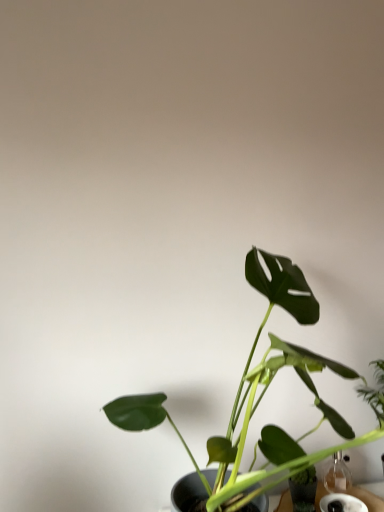
Question: From a real-world perspective, is transparent glass vase at lower right on green matte leafy plant at center?

Choices:
 (A) yes
 (B) no

Answer: (B)

Question: Is transparent glass vase at lower right taller than green matte leafy plant at center?

Choices:
 (A) no
 (B) yes

Answer: (A)

Question: Considering the relative sizes of transparent glass vase at lower right and green matte leafy plant at center in the image provided, is transparent glass vase at lower right bigger than green matte leafy plant at center?

Choices:
 (A) yes
 (B) no

Answer: (B)

Question: Is transparent glass vase at lower right far away from green matte leafy plant at center?

Choices:
 (A) yes
 (B) no

Answer: (B)

Question: From a real-world perspective, is transparent glass vase at lower right located beneath green matte leafy plant at center?

Choices:
 (A) no
 (B) yes

Answer: (B)

Question: Is transparent glass vase at lower right facing towards green matte leafy plant at center?

Choices:
 (A) no
 (B) yes

Answer: (B)

Question: Does green matte leafy plant at center have a greater width compared to transparent glass vase at lower right?

Choices:
 (A) yes
 (B) no

Answer: (A)

Question: Could you tell me if green matte leafy plant at center is facing transparent glass vase at lower right?

Choices:
 (A) yes
 (B) no

Answer: (B)

Question: Considering the relative sizes of green matte leafy plant at center and transparent glass vase at lower right in the image provided, is green matte leafy plant at center smaller than transparent glass vase at lower right?

Choices:
 (A) yes
 (B) no

Answer: (B)

Question: From a real-world perspective, does green matte leafy plant at center stand above transparent glass vase at lower right?

Choices:
 (A) yes
 (B) no

Answer: (A)

Question: From the image's perspective, is green matte leafy plant at center above transparent glass vase at lower right?

Choices:
 (A) no
 (B) yes

Answer: (B)

Question: Is green matte leafy plant at center closer to the viewer compared to transparent glass vase at lower right?

Choices:
 (A) no
 (B) yes

Answer: (B)

Question: From their relative heights in the image, would you say transparent glass vase at lower right is taller or shorter than green matte leafy plant at center?

Choices:
 (A) tall
 (B) short

Answer: (B)